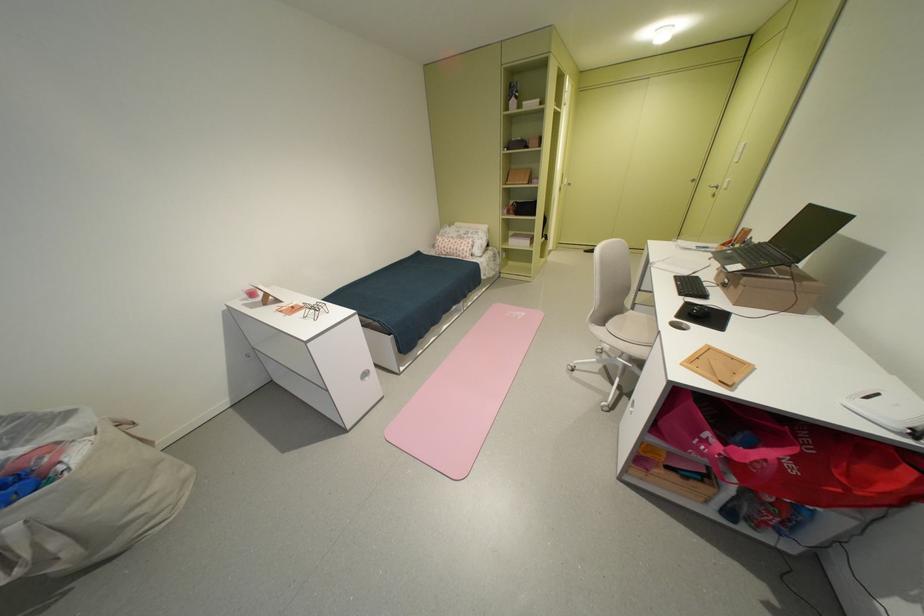
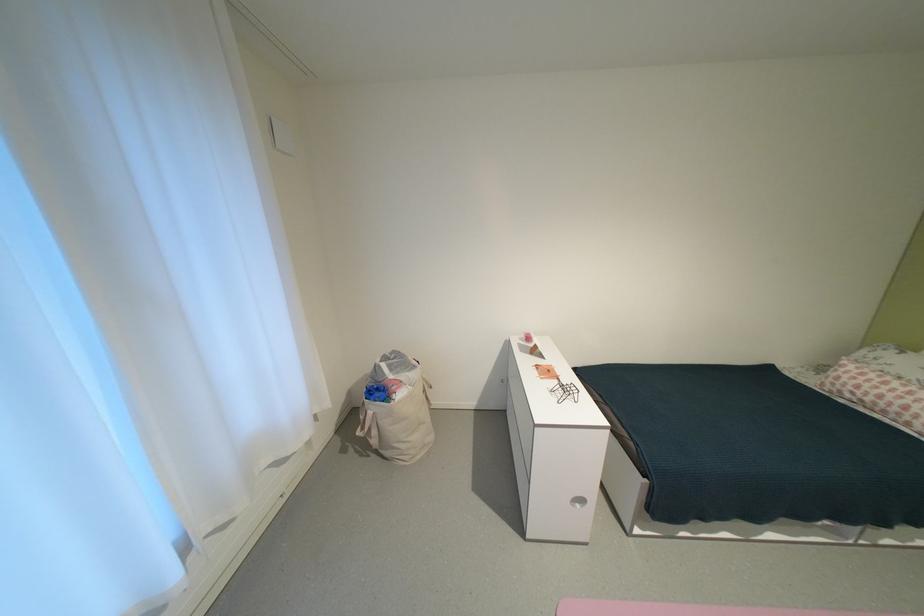
The point at (x=301, y=310) is marked in the first image. Where is the corresponding point in the second image?

(556, 374)